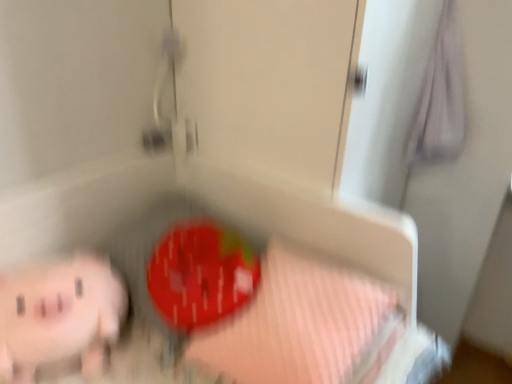
Question: Based on their sizes in the image, would you say pink striped fabric at lower center is bigger or smaller than pink rubber piggy bank at lower left?

Choices:
 (A) small
 (B) big

Answer: (B)

Question: From a real-world perspective, is pink striped fabric at lower center positioned above or below pink rubber piggy bank at lower left?

Choices:
 (A) below
 (B) above

Answer: (B)

Question: Is pink striped fabric at lower center inside the boundaries of pink rubber piggy bank at lower left, or outside?

Choices:
 (A) outside
 (B) inside

Answer: (A)

Question: Considering the positions of pink rubber piggy bank at lower left and pink striped fabric at lower center in the image, is pink rubber piggy bank at lower left wider or thinner than pink striped fabric at lower center?

Choices:
 (A) wide
 (B) thin

Answer: (B)

Question: Considering the positions of pink rubber piggy bank at lower left and pink striped fabric at lower center in the image, is pink rubber piggy bank at lower left bigger or smaller than pink striped fabric at lower center?

Choices:
 (A) small
 (B) big

Answer: (A)

Question: Is pink rubber piggy bank at lower left situated inside pink striped fabric at lower center or outside?

Choices:
 (A) outside
 (B) inside

Answer: (A)

Question: In the image, is pink rubber piggy bank at lower left positioned in front of or behind pink striped fabric at lower center?

Choices:
 (A) behind
 (B) front

Answer: (A)